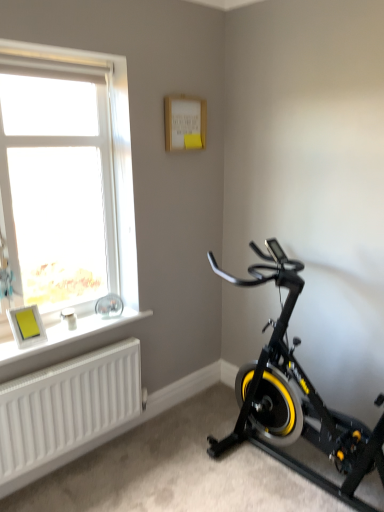
I want to click on free space above white matte window sill at lower left (from a real-world perspective), so click(x=84, y=322).